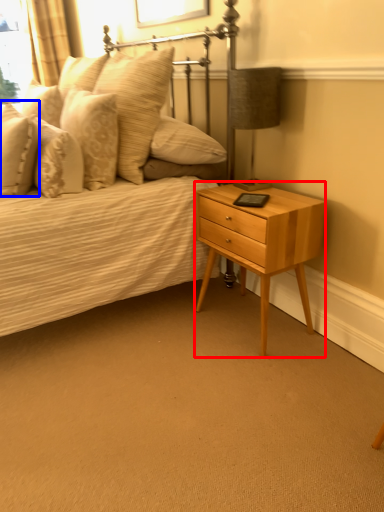
Question: Which point is closer to the camera, nightstand (highlighted by a red box) or pillow (highlighted by a blue box)?

Choices:
 (A) nightstand
 (B) pillow

Answer: (A)